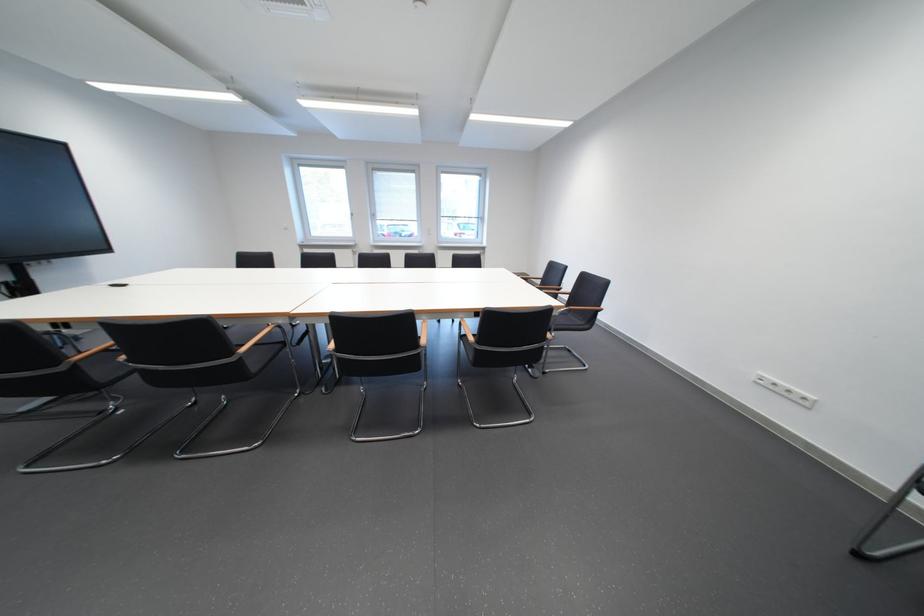
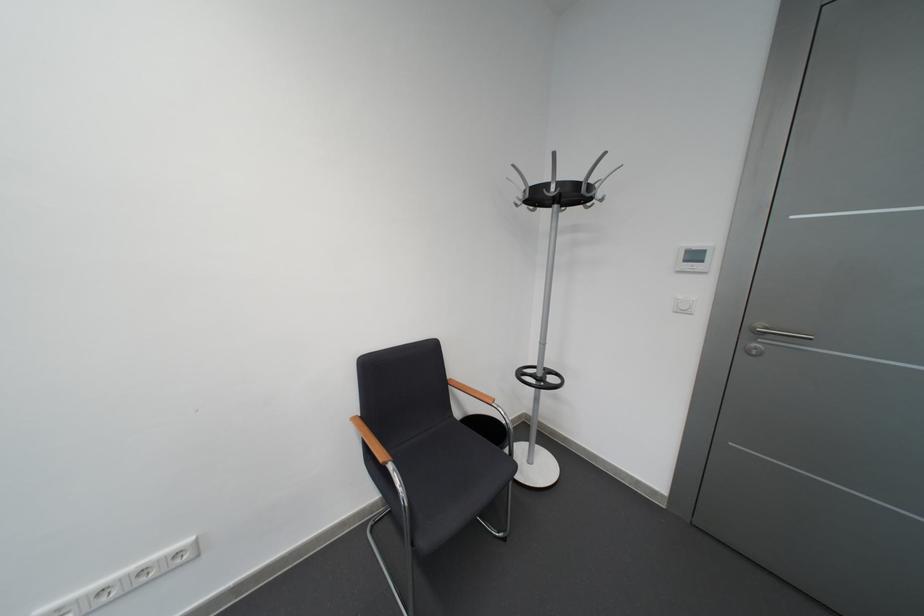
Where in the second image is the point corresponding to point 787,386 from the first image?

(116, 593)